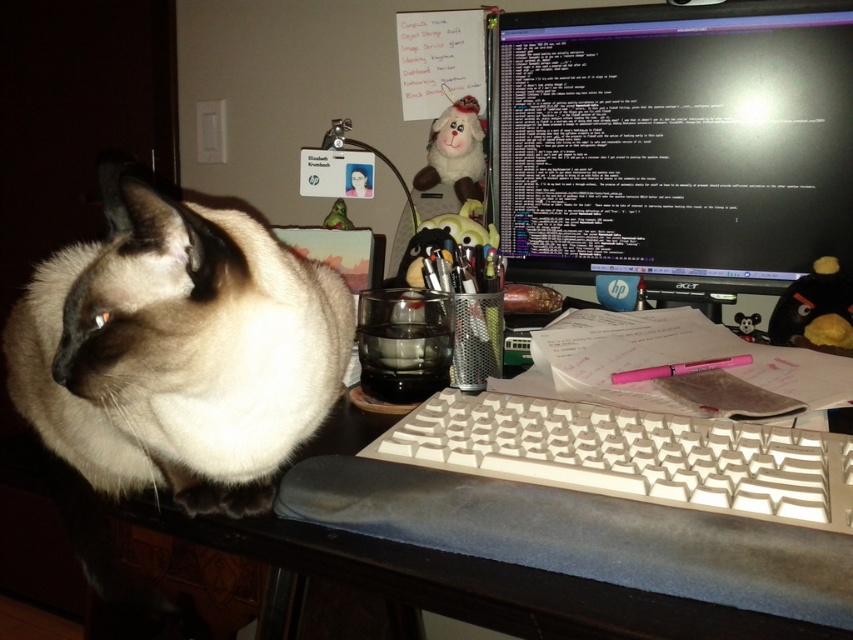
Which is in front, point (792, 76) or point (639, 374)?

Point (639, 374) is more forward.

Locate an element on the screen. black glossy monitor at upper right is located at coordinates [x=676, y=144].

Find the location of a particular element. black glossy monitor at upper right is located at coordinates (676, 144).

Is black matte table at left shorter than white plastic keyboard at center?

Incorrect, black matte table at left's height does not fall short of white plastic keyboard at center's.

Between black matte table at left and white plastic keyboard at center, which one has less height?

With less height is white plastic keyboard at center.

Is point (788, 550) farther from camera compared to point (753, 467)?

That is False.

Where is `black matte table at left`? The height and width of the screenshot is (640, 853). black matte table at left is located at coordinates (556, 528).

Is smokey white fur cat at left to the left of pink plastic pen at lower right from the viewer's perspective?

Yes, smokey white fur cat at left is to the left of pink plastic pen at lower right.

Is smokey white fur cat at left above pink plastic pen at lower right?

Correct, smokey white fur cat at left is located above pink plastic pen at lower right.

What are the coordinates of `smokey white fur cat at left` in the screenshot? It's located at (177, 349).